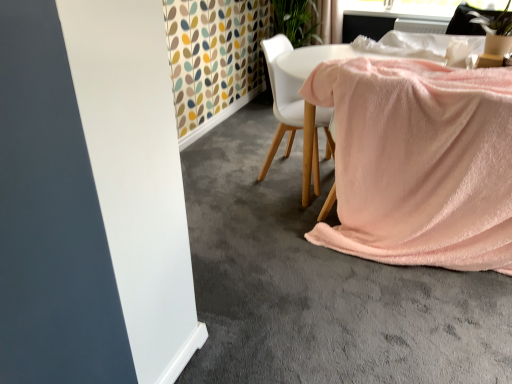
Find the location of a particular element. Image resolution: width=512 pixels, height=384 pixels. vacant area that lies between white fabric chair at center and pink soft fabric at center is located at coordinates (254, 188).